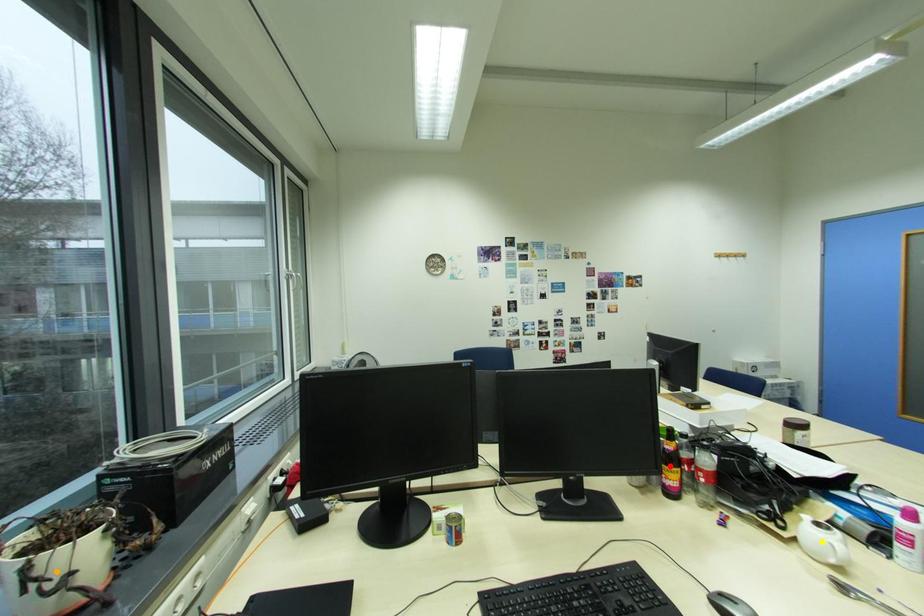
Order these from farthest to nearest:
1. red point
2. yellow point
3. orange point

red point, yellow point, orange point